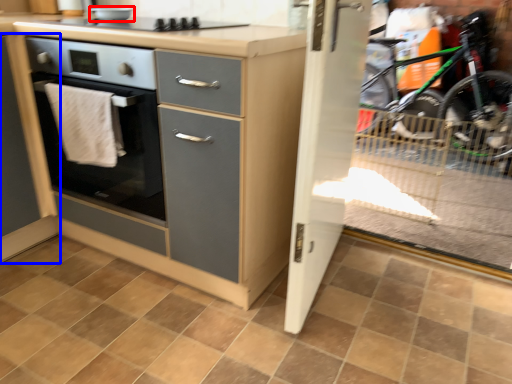
Question: Which object is closer to the camera taking this photo, appliance (highlighted by a red box) or cabinetry (highlighted by a blue box)?

Choices:
 (A) appliance
 (B) cabinetry

Answer: (B)